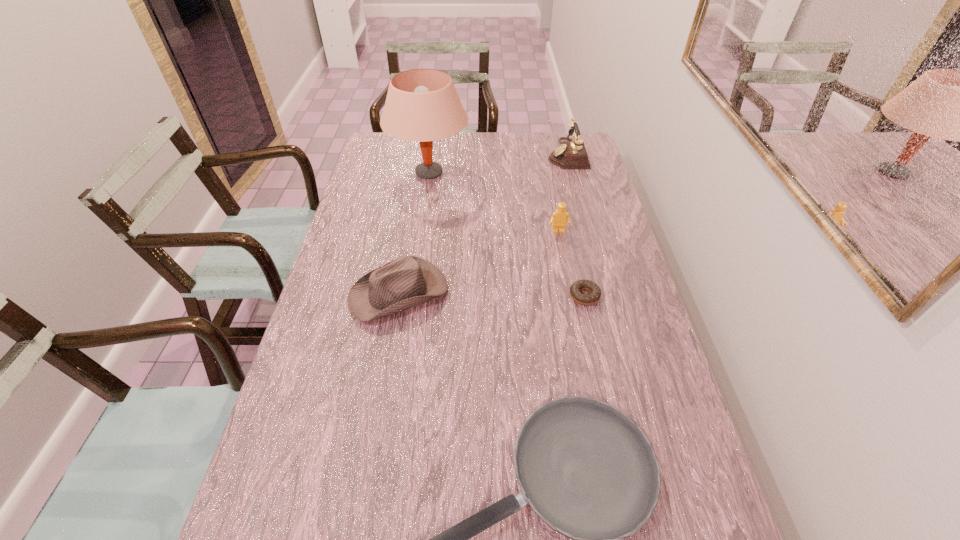
Where is `free area in between the fifth shortest object and the fedora`? free area in between the fifth shortest object and the fedora is located at coordinates (483, 224).

In order to click on vacant point located between the fedora and the doughnut in this screenshot , I will do `click(492, 294)`.

Identify which object is the third nearest to the telephone. Please provide its 2D coordinates. Your answer should be formatted as a tuple, i.e. [(x, y)], where the tuple contains the x and y coordinates of a point satisfying the conditions above.

[(595, 293)]

Locate which object is the closest to the nearest object. Please provide its 2D coordinates. Your answer should be formatted as a tuple, i.e. [(x, y)], where the tuple contains the x and y coordinates of a point satisfying the conditions above.

[(408, 281)]

This screenshot has width=960, height=540. What are the coordinates of `free space that satisfies the following two spatial constraints: 1. on the dial of the fifth shortest object; 2. on the face of the Lego` in the screenshot? It's located at (587, 232).

Image resolution: width=960 pixels, height=540 pixels. I want to click on free location that satisfies the following two spatial constraints: 1. on the face of the Lego; 2. on the left side of the doughnut, so click(570, 296).